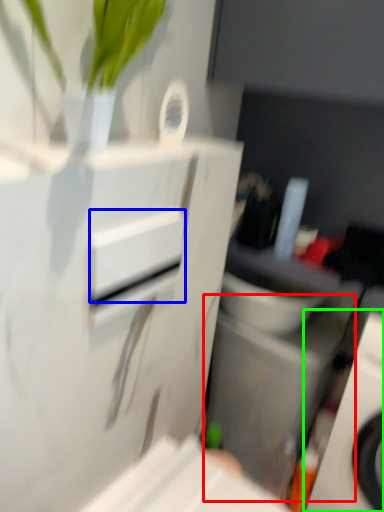
Question: Estimate the real-world distances between objects in this image. Which object is closer to appliance (highlighted by a red box), drawer (highlighted by a blue box) or home appliance (highlighted by a green box)?

Choices:
 (A) drawer
 (B) home appliance

Answer: (B)